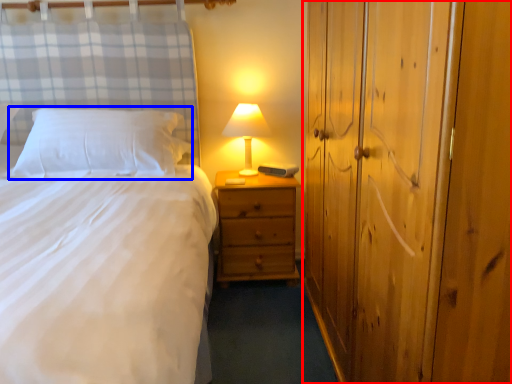
Question: Which point is closer to the camera, dresser (highlighted by a red box) or pillow (highlighted by a blue box)?

Choices:
 (A) dresser
 (B) pillow

Answer: (A)